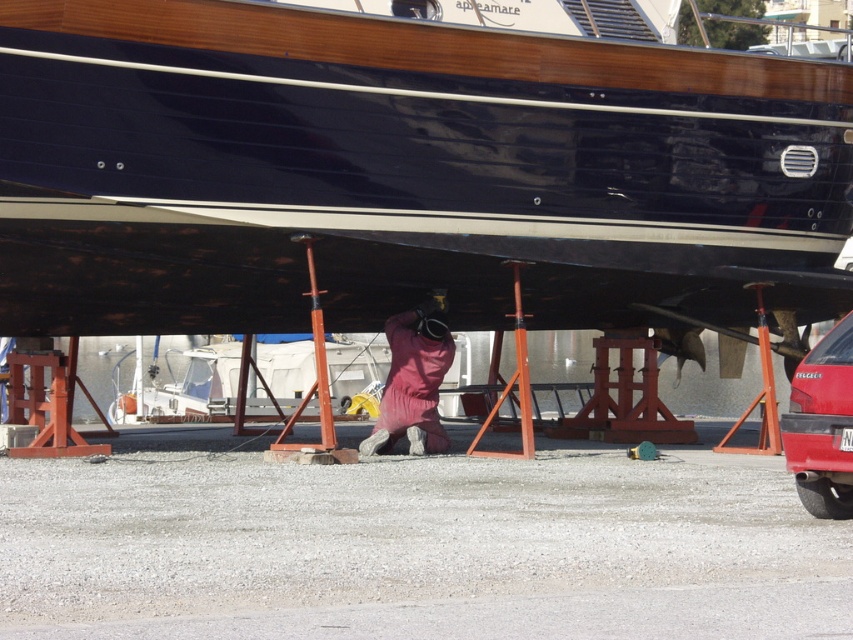
You are standing at the center of the boatyard and want to move to the shiny red car at lower right. Which direction should you move in to reach it?

Since the shiny red car at lower right is located at point 0.666 on the x axis and 0.965 on the y axis, you should move towards the lower right direction to reach it.

You are standing in the boatyard and want to place a ladder so that it reaches both the point at coordinates [828,336] and the point at [407,364]. Which point should the ladder be placed closer to you to reach first?

The ladder should be placed closer to the point at [828,336] first because it is closer to the viewer than the point at [407,364].